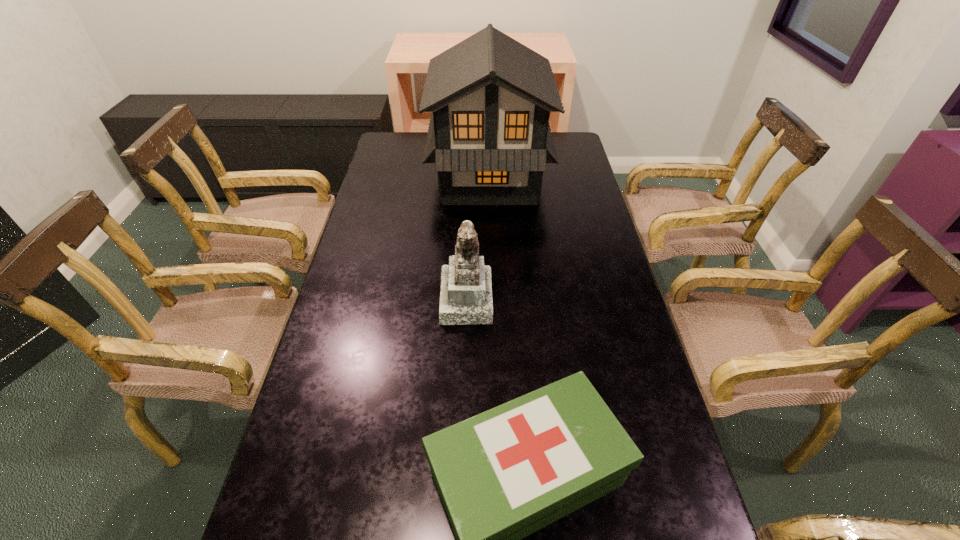
The height and width of the screenshot is (540, 960). I want to click on the tallest object, so click(489, 136).

The width and height of the screenshot is (960, 540). Find the location of `dollhouse`. dollhouse is located at coordinates (489, 136).

The image size is (960, 540). I want to click on figurine, so click(x=466, y=290).

Where is `the second shortest object`? The image size is (960, 540). the second shortest object is located at coordinates (466, 290).

The width and height of the screenshot is (960, 540). What are the coordinates of `free region located on the front-facing side of the tallest object` in the screenshot? It's located at (380, 178).

Locate an element on the screen. free space located 0.190m on the front-facing side of the tallest object is located at coordinates (380, 178).

This screenshot has width=960, height=540. I want to click on free space located 0.070m on the front-facing side of the tallest object, so pyautogui.click(x=412, y=178).

Locate an element on the screen. Image resolution: width=960 pixels, height=540 pixels. free space located 0.160m on the front-facing side of the second nearest object is located at coordinates (549, 297).

Locate an element on the screen. The height and width of the screenshot is (540, 960). object that is at the far edge is located at coordinates (489, 136).

Image resolution: width=960 pixels, height=540 pixels. What are the coordinates of `object at the right edge` in the screenshot? It's located at (489, 136).